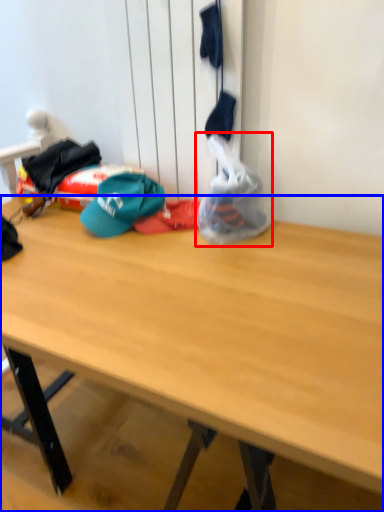
Question: Which of the following is the closest to the observer, plastic bag (highlighted by a red box) or desk (highlighted by a blue box)?

Choices:
 (A) plastic bag
 (B) desk

Answer: (B)